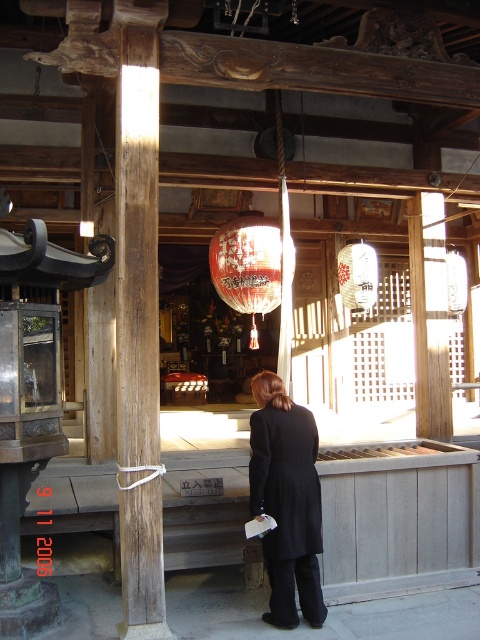
Question: Does white paper lantern at center come in front of red paper lantern at center?

Choices:
 (A) yes
 (B) no

Answer: (A)

Question: Among these points, which one is nearest to the camera?

Choices:
 (A) (218, 234)
 (B) (348, 262)

Answer: (A)

Question: Does weathered wood pole at left appear under white paper lantern at center?

Choices:
 (A) yes
 (B) no

Answer: (A)

Question: Estimate the real-world distances between objects in this image. Which object is closer to the black wool coat at center?

Choices:
 (A) red paper lantern at center
 (B) weathered wood pole at left
 (C) white paper lantern at center

Answer: (B)

Question: Which point appears farthest from the camera in this image?

Choices:
 (A) (233, 305)
 (B) (370, 246)

Answer: (B)

Question: Is weathered wood pole at left bigger than red paper lantern at center?

Choices:
 (A) yes
 (B) no

Answer: (A)